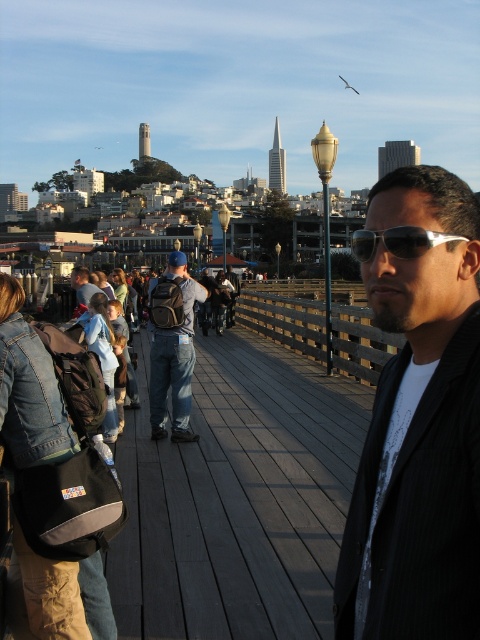
Between black pinstripe suit at center and denim jacket at center, which one is positioned higher?

denim jacket at center is higher up.

Is point (369, 433) farther from camera compared to point (83, 284)?

No, it is in front of (83, 284).

Identify the location of black pinstripe suit at center. (418, 419).

Is matte black backpack at center positioned before denim jacket at center?

That is True.

Where is `matte black backpack at center`? The image size is (480, 640). matte black backpack at center is located at coordinates 172,348.

Locate an element on the screen. This screenshot has height=640, width=480. wooden at center is located at coordinates (285, 321).

Measure the distance from wooden at center to sunglasses at center.

wooden at center is 118.01 feet away from sunglasses at center.

This screenshot has height=640, width=480. I want to click on wooden at center, so 285,321.

Image resolution: width=480 pixels, height=640 pixels. In order to click on wooden at center in this screenshot , I will do `click(285, 321)`.